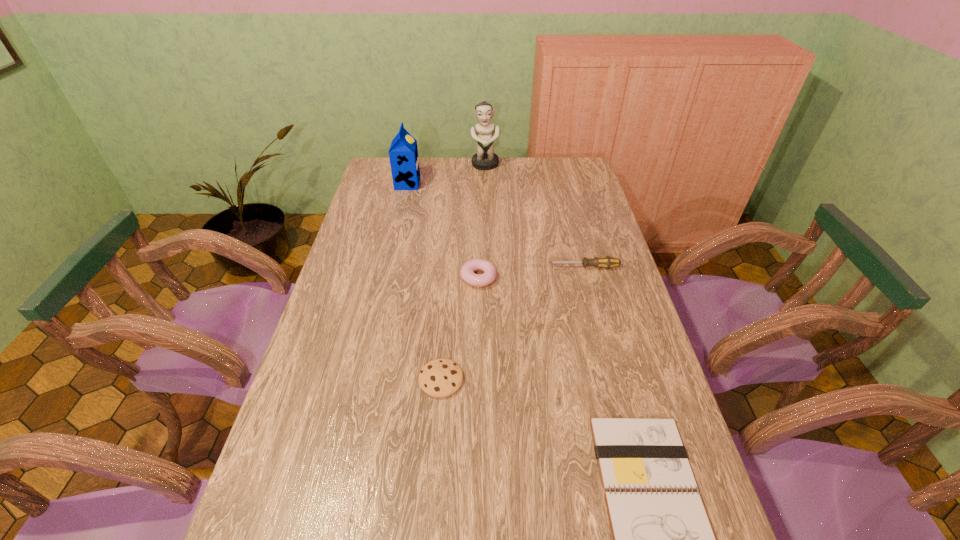
Identify the location of free space located at the tip of the screwdriver. The width and height of the screenshot is (960, 540). (475, 267).

The height and width of the screenshot is (540, 960). What are the coordinates of `vacant space located at the tip of the screwdriver` in the screenshot? It's located at (444, 267).

This screenshot has height=540, width=960. I want to click on vacant space located on the front of the cookie, so coord(437,434).

Locate an element on the screen. figurine located in the far edge section of the desktop is located at coordinates (485, 159).

Find the location of a particular element. carton at the far edge is located at coordinates (403, 153).

Where is `object that is at the left edge`? object that is at the left edge is located at coordinates (403, 153).

The width and height of the screenshot is (960, 540). In order to click on object at the right edge in this screenshot , I will do `click(607, 262)`.

At what (x,y) coordinates should I click in order to perform the action: click on object present at the far left corner. Please return your answer as a coordinate pair (x, y). The image size is (960, 540). Looking at the image, I should click on (403, 153).

Identify the location of vacant region at the far edge of the desktop. (452, 161).

Identify the location of free region at the left edge of the desktop. (376, 302).